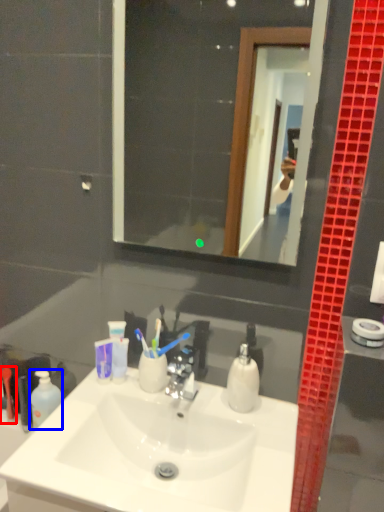
Question: Which of the following is the farthest to the observer, toiletry (highlighted by a red box) or mouthwash (highlighted by a blue box)?

Choices:
 (A) toiletry
 (B) mouthwash

Answer: (A)